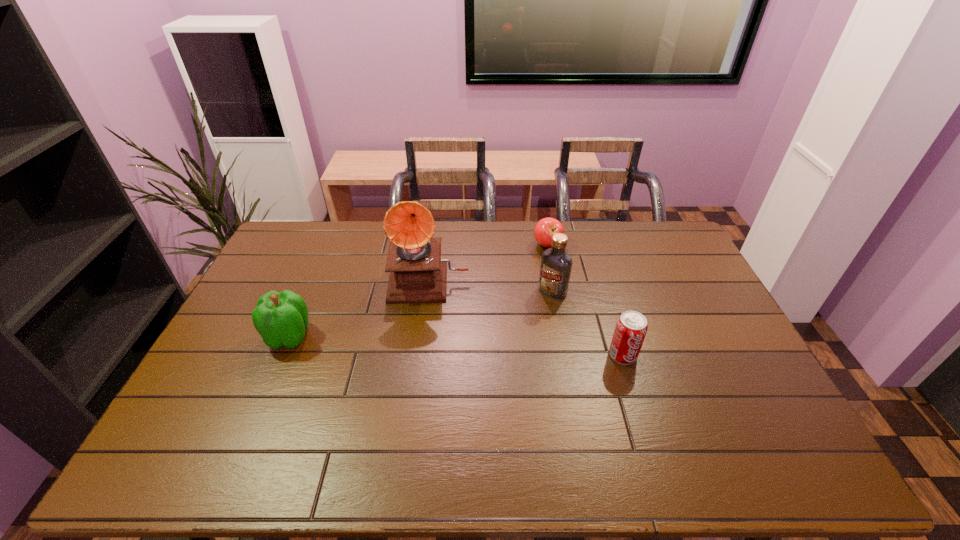
Image resolution: width=960 pixels, height=540 pixels. Find the location of `bell pepper`. bell pepper is located at coordinates (281, 318).

Find the location of `soda can`. soda can is located at coordinates (631, 327).

Where is `the rightmost object`? This screenshot has width=960, height=540. the rightmost object is located at coordinates (631, 327).

Find the location of a particular element. The height and width of the screenshot is (540, 960). apple is located at coordinates (544, 230).

The width and height of the screenshot is (960, 540). What are the coordinates of `the shortest object` in the screenshot? It's located at (x=544, y=230).

The width and height of the screenshot is (960, 540). In order to click on the tallest object in this screenshot , I will do `click(418, 274)`.

What are the coordinates of `the fourth object from right to left` in the screenshot? It's located at (418, 274).

This screenshot has height=540, width=960. I want to click on the second tallest object, so click(x=555, y=269).

Find the location of a particular element. This screenshot has height=540, width=960. free spot located on the back of the bell pepper is located at coordinates (304, 303).

At what (x,y) coordinates should I click in order to perform the action: click on vacant point located on the left of the fourth tallest object. Please return your answer as a coordinate pair (x, y). This screenshot has height=540, width=960. Looking at the image, I should click on (567, 355).